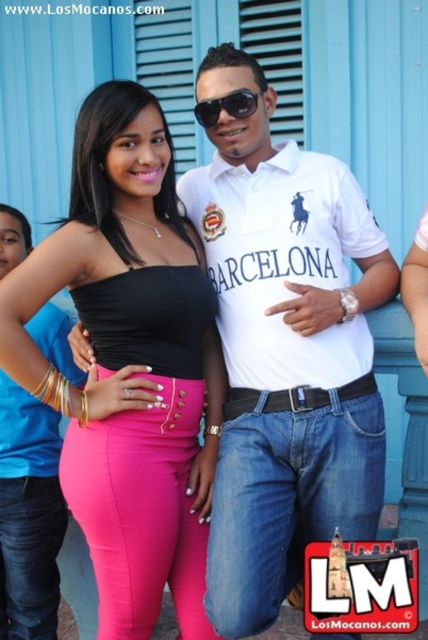
Is matte black top at center behind pink matte leggings at lower left?

That is True.

What do you see at coordinates (130, 364) in the screenshot? I see `matte black top at center` at bounding box center [130, 364].

The image size is (428, 640). I want to click on matte black top at center, so click(130, 364).

Between pink matte leggings at lower left and pink matte pants at lower center, which one is positioned higher?

pink matte leggings at lower left

Is pink matte leggings at lower left above pink matte pants at lower center?

Result: Yes.

Is point (302, 540) positioned behind point (3, 506)?

No, it is in front of (3, 506).

Identify the location of pink matte leggings at lower left. (288, 496).

How far apart are pink matte leggings at center and sunglasses at center?

pink matte leggings at center and sunglasses at center are 5.24 feet apart.

Which of these two, pink matte leggings at center or sunglasses at center, stands shorter?

Standing shorter between the two is sunglasses at center.

Is point (165, 467) less distant than point (256, 102)?

Yes, it is.

You are a GUI agent. You are given a task and a screenshot of the screen. Output one action in this format:
    pyautogui.click(x=<x>, y=<y>)
    Task: Click on the pink matte leggings at center
    
    Given the screenshot: What is the action you would take?
    pyautogui.click(x=140, y=513)